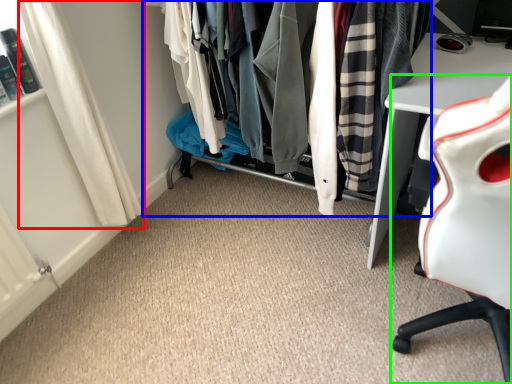
Question: Which object is the closest to the curtain (highlighted by a red box)? Choose among these: closet (highlighted by a blue box) or chair (highlighted by a green box).

Choices:
 (A) closet
 (B) chair

Answer: (A)